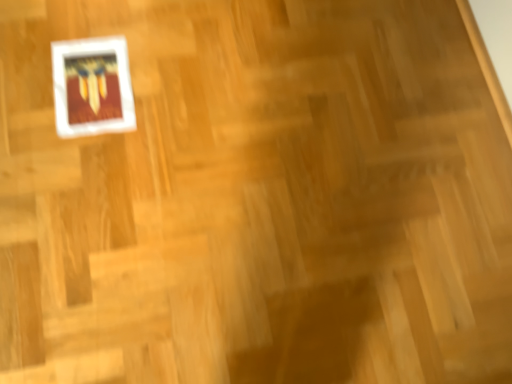
Identify the location of vacant location behind white glossy picture frame at upper left. (138, 29).